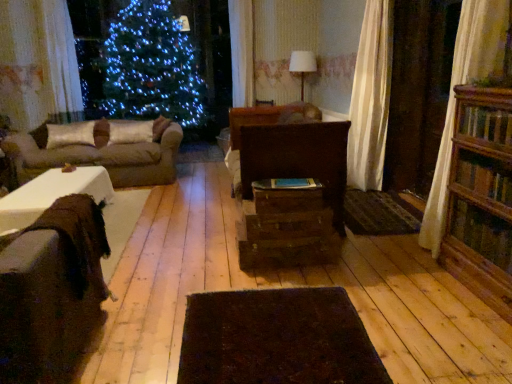
Question: Is wooden bookcase at right bigger or smaller than dark brown textured mat at center?

Choices:
 (A) big
 (B) small

Answer: (A)

Question: Is wooden bookcase at right situated inside dark brown textured mat at center or outside?

Choices:
 (A) outside
 (B) inside

Answer: (A)

Question: Estimate the real-world distances between objects in this image. Which object is closer to the brown fabric couch at left, the second studio couch positioned from the bottom?

Choices:
 (A) dark brown textured mat at center
 (B) white sheer curtain at upper left
 (C) wooden bookcase at right
 (D) wooden drawer at center, placed as the 2th drawer when sorted from top to bottom
 (E) silky beige pillow at center, the first pillow from the right

Answer: (E)

Question: Estimate the real-world distances between objects in this image. Which object is farther from the dark brown rug at center?

Choices:
 (A) dark brown textured mat at center
 (B) brown fuzzy studio couch at left, acting as the 1th studio couch starting from the bottom
 (C) wooden drawer at center, placed as the 2th drawer when sorted from top to bottom
 (D) brown fabric couch at left, which is the first studio couch in back-to-front order
 (E) silky beige pillow at center, the first pillow from the right

Answer: (E)